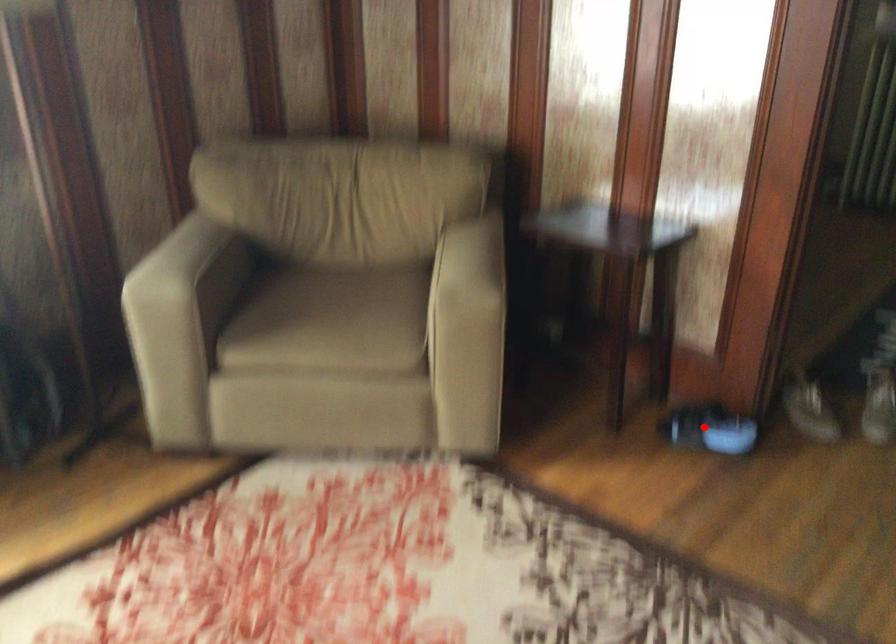
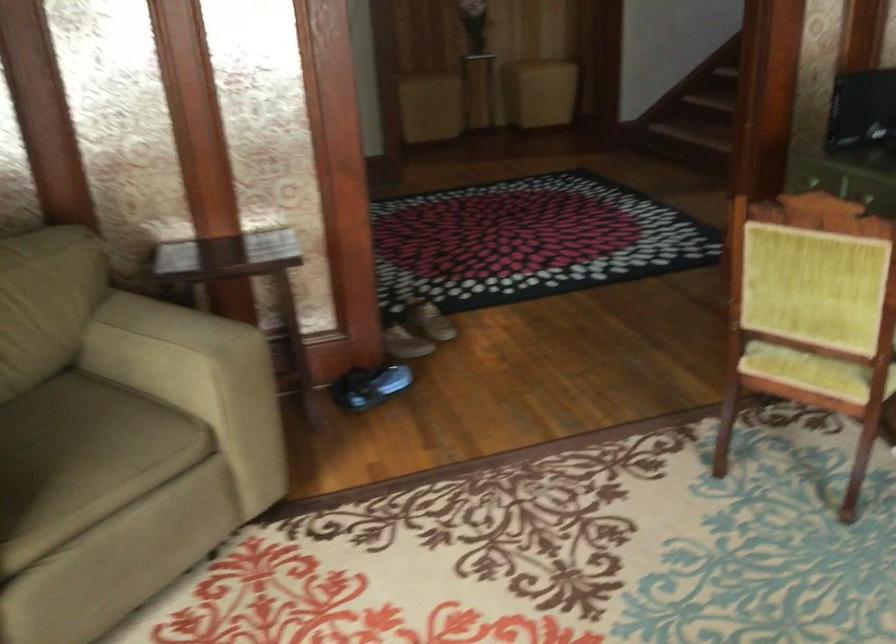
Question: A red point is marked in image1. In image2, is the corresponding 3D point closer to the camera or farther? Reply with the corresponding letter.

Choices:
 (A) The corresponding 3D point is closer.
 (B) The corresponding 3D point is farther.

Answer: (B)